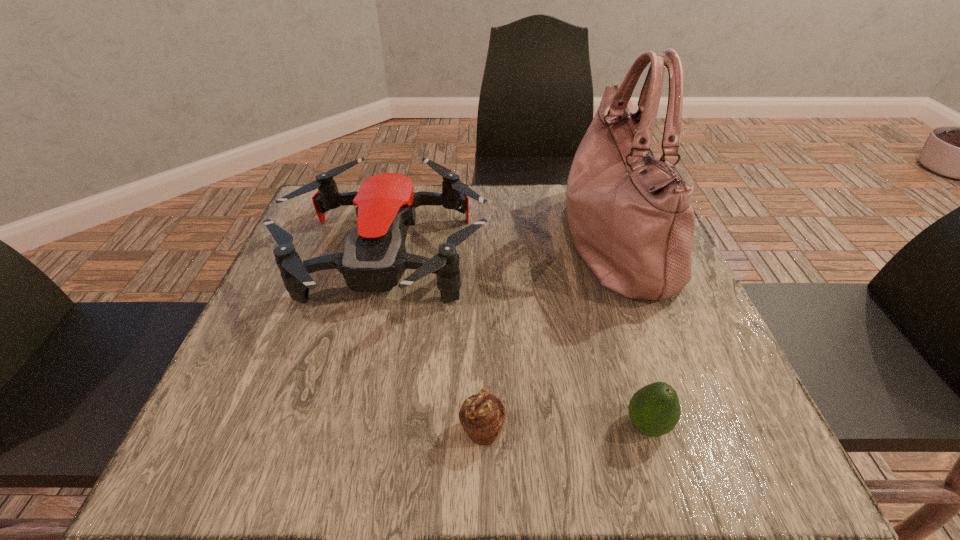
Identify the location of free space between the drone and the avocado. (516, 342).

Locate an element on the screen. Image resolution: width=960 pixels, height=540 pixels. free area in between the muffin and the third shortest object is located at coordinates [434, 345].

Identify the location of vacant region between the avocado and the second tallest object. (516, 342).

Locate an element on the screen. This screenshot has width=960, height=540. vacant area that lies between the handbag and the avocado is located at coordinates (631, 333).

You are a GUI agent. You are given a task and a screenshot of the screen. Output one action in this format:
    pyautogui.click(x=<x>, y=<y>)
    Task: Click on the vacant space that's between the avocado and the handbag
    This screenshot has height=540, width=960.
    Given the screenshot: What is the action you would take?
    pyautogui.click(x=631, y=333)

Select which object is the third closest to the second tallest object. Please provide its 2D coordinates. Your answer should be formatted as a tuple, i.e. [(x, y)], where the tuple contains the x and y coordinates of a point satisfying the conditions above.

[(654, 410)]

The width and height of the screenshot is (960, 540). Identify the location of the closest object to the tallest object. (374, 258).

The height and width of the screenshot is (540, 960). Identify the location of free spot that satisfies the following two spatial constraints: 1. on the camera side of the muffin; 2. on the right side of the third shortest object. (346, 431).

Where is `vacant area in the image that satisfies the following two spatial constraints: 1. on the back side of the muffin; 2. on the left side of the avocado`? The width and height of the screenshot is (960, 540). vacant area in the image that satisfies the following two spatial constraints: 1. on the back side of the muffin; 2. on the left side of the avocado is located at coordinates (482, 426).

Find the location of `vacant space that satisfies the following two spatial constraints: 1. at the front of the tallest object with handles; 2. on the camera side of the second tallest object`. vacant space that satisfies the following two spatial constraints: 1. at the front of the tallest object with handles; 2. on the camera side of the second tallest object is located at coordinates (620, 259).